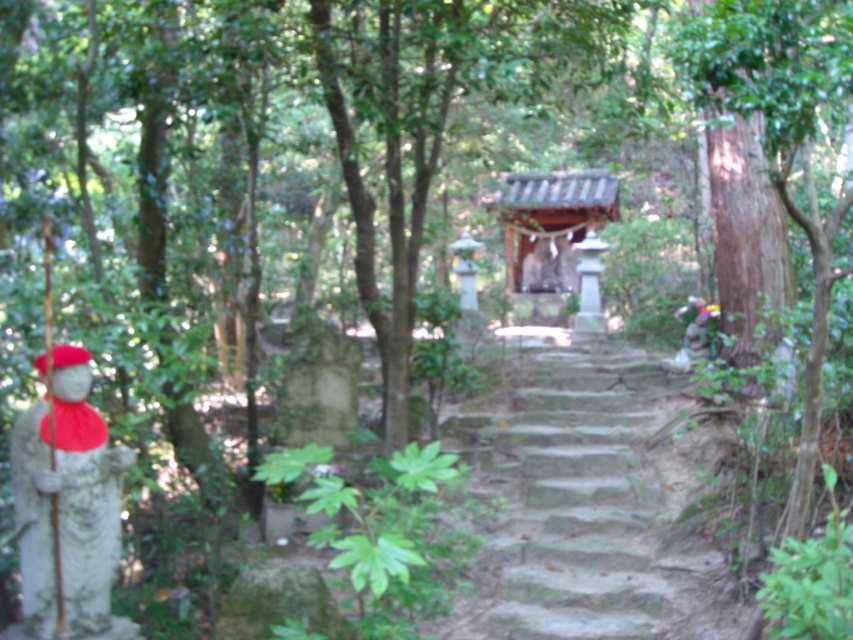
Question: Is stone steps at center positioned behind smooth stone statue at left?

Choices:
 (A) yes
 (B) no

Answer: (A)

Question: Which point is farther from the camera taking this photo?

Choices:
 (A) (71, 458)
 (B) (651, 488)

Answer: (B)

Question: Is stone steps at center below smooth stone statue at left?

Choices:
 (A) no
 (B) yes

Answer: (B)

Question: Is stone steps at center positioned behind smooth stone statue at left?

Choices:
 (A) no
 (B) yes

Answer: (B)